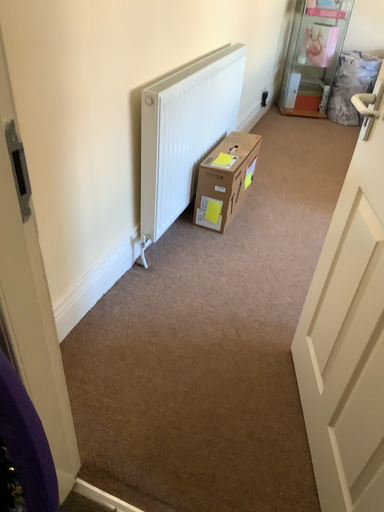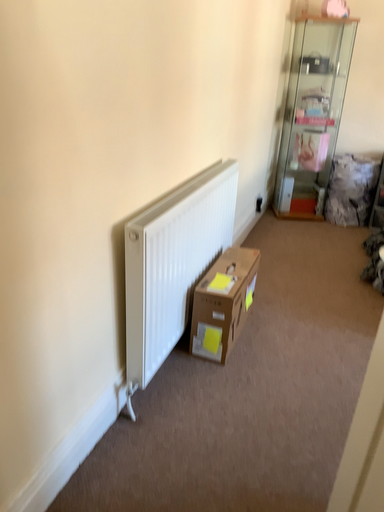
Question: How did the camera likely rotate when shooting the video?

Choices:
 (A) rotated upward
 (B) rotated downward

Answer: (A)